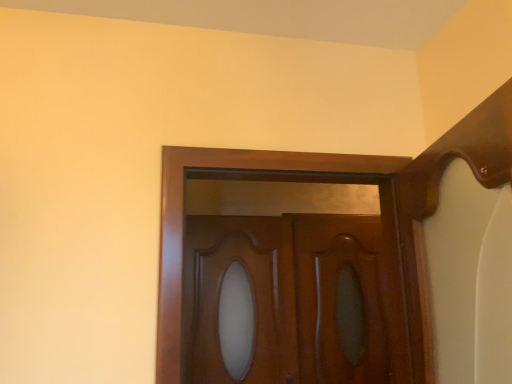
Question: From a real-world perspective, is glossy wood door at center on top of glossy wood screen door at center?

Choices:
 (A) no
 (B) yes

Answer: (B)

Question: Is the depth of glossy wood door at center less than that of glossy wood screen door at center?

Choices:
 (A) yes
 (B) no

Answer: (A)

Question: Can you confirm if glossy wood door at center is smaller than glossy wood screen door at center?

Choices:
 (A) no
 (B) yes

Answer: (A)

Question: Can you see glossy wood door at center touching glossy wood screen door at center?

Choices:
 (A) yes
 (B) no

Answer: (A)

Question: Can you confirm if glossy wood door at center is shorter than glossy wood screen door at center?

Choices:
 (A) no
 (B) yes

Answer: (B)

Question: From a real-world perspective, is glossy wood door at center beneath glossy wood screen door at center?

Choices:
 (A) yes
 (B) no

Answer: (B)

Question: Can you confirm if glossy wood screen door at center is shorter than glossy wood door at center?

Choices:
 (A) no
 (B) yes

Answer: (A)

Question: Is glossy wood screen door at center positioned in front of glossy wood door at center?

Choices:
 (A) yes
 (B) no

Answer: (B)

Question: Is glossy wood screen door at center not near glossy wood door at center?

Choices:
 (A) no
 (B) yes

Answer: (A)

Question: Is glossy wood screen door at center thinner than glossy wood door at center?

Choices:
 (A) no
 (B) yes

Answer: (B)

Question: Can you confirm if glossy wood screen door at center is taller than glossy wood door at center?

Choices:
 (A) no
 (B) yes

Answer: (B)

Question: Is glossy wood screen door at center behind glossy wood door at center?

Choices:
 (A) no
 (B) yes

Answer: (B)

Question: Does glossy wood door at center have a greater height compared to glossy wood door at center?

Choices:
 (A) no
 (B) yes

Answer: (B)